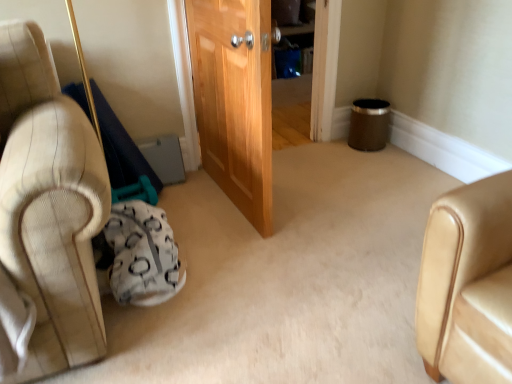
Question: From their relative heights in the image, would you say wooden door at center is taller or shorter than white textured bean bag at lower left?

Choices:
 (A) tall
 (B) short

Answer: (A)

Question: Do you think wooden door at center is within white textured bean bag at lower left, or outside of it?

Choices:
 (A) outside
 (B) inside

Answer: (A)

Question: From a real-world perspective, is wooden door at center physically located above or below white textured bean bag at lower left?

Choices:
 (A) above
 (B) below

Answer: (A)

Question: From a real-world perspective, is white textured bean bag at lower left positioned above or below wooden door at center?

Choices:
 (A) below
 (B) above

Answer: (A)

Question: Is white textured bean bag at lower left wider or thinner than wooden door at center?

Choices:
 (A) thin
 (B) wide

Answer: (B)

Question: In terms of size, does white textured bean bag at lower left appear bigger or smaller than wooden door at center?

Choices:
 (A) small
 (B) big

Answer: (A)

Question: Which is correct: white textured bean bag at lower left is inside wooden door at center, or outside of it?

Choices:
 (A) outside
 (B) inside

Answer: (A)